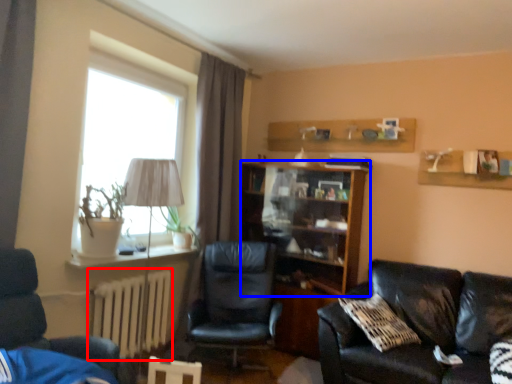
Question: Which object appears farthest to the camera in this image, radiator (highlighted by a red box) or shelf (highlighted by a blue box)?

Choices:
 (A) radiator
 (B) shelf

Answer: (B)